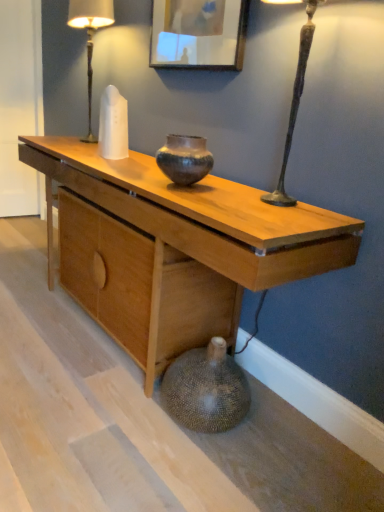
This screenshot has width=384, height=512. Identify the location of earthy brown ceramic vase at center. (184, 159).

What do you see at coordinates (200, 221) in the screenshot? I see `natural wood desk at center` at bounding box center [200, 221].

Image resolution: width=384 pixels, height=512 pixels. Describe the element at coordinates (90, 37) in the screenshot. I see `white glass table lamp at upper left` at that location.

Identify the location of earthy brown ceramic vase at center. (184, 159).

From the image's perspective, is wooden picture frame at upper center above or below natural wood desk at center?

wooden picture frame at upper center is situated higher than natural wood desk at center in the image.

Can you confirm if wooden picture frame at upper center is bigger than natural wood desk at center?

Incorrect, wooden picture frame at upper center is not larger than natural wood desk at center.

Are wooden picture frame at upper center and natural wood desk at center beside each other?

No, wooden picture frame at upper center is not making contact with natural wood desk at center.

Consider the image. Is wooden picture frame at upper center oriented away from natural wood desk at center?

wooden picture frame at upper center does not have its back to natural wood desk at center.

Considering the positions of objects earthy brown ceramic vase at center and wooden picture frame at upper center in the image provided, who is behind, earthy brown ceramic vase at center or wooden picture frame at upper center?

Positioned behind is wooden picture frame at upper center.

Is the surface of earthy brown ceramic vase at center in direct contact with wooden picture frame at upper center?

earthy brown ceramic vase at center and wooden picture frame at upper center are clearly separated.

Which is less distant, (194, 180) or (202, 33)?

The point (194, 180) is closer to the camera.

In the scene shown: From a real-world perspective, is earthy brown ceramic vase at center under wooden picture frame at upper center?

Yes.

How much distance is there between natural wood desk at center and wooden picture frame at upper center?

natural wood desk at center is 29.23 inches from wooden picture frame at upper center.

Considering the sizes of objects natural wood desk at center and wooden picture frame at upper center in the image provided, who is thinner, natural wood desk at center or wooden picture frame at upper center?

wooden picture frame at upper center is thinner.

Between point (304, 227) and point (229, 21), which one is positioned behind?

Positioned behind is point (229, 21).

Is natural wood desk at center oriented away from wooden picture frame at upper center?

No, natural wood desk at center is not facing away from wooden picture frame at upper center.

Considering the positions of point (231, 219) and point (91, 56), is point (231, 219) closer or farther from the camera than point (91, 56)?

Point (231, 219) is positioned closer to the camera compared to point (91, 56).

Which of these two, natural wood desk at center or white glass table lamp at upper left, stands taller?

Standing taller between the two is natural wood desk at center.

Based on the photo, which is correct: natural wood desk at center is inside white glass table lamp at upper left, or outside of it?

natural wood desk at center is located beyond the bounds of white glass table lamp at upper left.

Does point (76, 0) lie behind point (188, 147)?

Yes.

What's the angular difference between white glass table lamp at upper left and earthy brown ceramic vase at center's facing directions?

The angle between the facing direction of white glass table lamp at upper left and the facing direction of earthy brown ceramic vase at center is 0.62 degrees.

Visually, is white glass table lamp at upper left positioned to the left or to the right of earthy brown ceramic vase at center?

From the image, it's evident that white glass table lamp at upper left is to the left of earthy brown ceramic vase at center.

From the picture: Could you tell me if white glass table lamp at upper left is facing earthy brown ceramic vase at center?

No, white glass table lamp at upper left is not oriented towards earthy brown ceramic vase at center.

Between natural wood desk at center and earthy brown ceramic vase at center, which one has smaller width?

Thinner between the two is earthy brown ceramic vase at center.

Which is nearer, (x=107, y=200) or (x=178, y=157)?

Point (x=107, y=200) appears to be farther away from the viewer than point (x=178, y=157).

Looking at this image, from the image's perspective, is natural wood desk at center on earthy brown ceramic vase at center?

Actually, natural wood desk at center appears below earthy brown ceramic vase at center in the image.

Is natural wood desk at center facing towards earthy brown ceramic vase at center?

No, natural wood desk at center is not aimed at earthy brown ceramic vase at center.

Is wooden picture frame at upper center facing away from white glass table lamp at upper left?

That's not correct — wooden picture frame at upper center is not looking away from white glass table lamp at upper left.

Is wooden picture frame at upper center positioned in front of white glass table lamp at upper left?

Yes, wooden picture frame at upper center is closer to the camera.

The width and height of the screenshot is (384, 512). I want to click on picture frame on the right side of white glass table lamp at upper left, so click(x=199, y=33).

From the image's perspective, which one is positioned lower, wooden picture frame at upper center or white glass table lamp at upper left?

wooden picture frame at upper center appears lower in the image.

At what (x,y) coordinates should I click in order to perform the action: click on desk that is below the wooden picture frame at upper center (from the image's perspective). Please return your answer as a coordinate pair (x, y). This screenshot has height=512, width=384. Looking at the image, I should click on 200,221.

You are a GUI agent. You are given a task and a screenshot of the screen. Output one action in this format:
    pyautogui.click(x=<x>, y=<y>)
    Task: Click on the vase that appears in front of the wooden picture frame at upper center
    The height and width of the screenshot is (512, 384).
    Given the screenshot: What is the action you would take?
    pyautogui.click(x=184, y=159)

From the image, which object appears to be farther from wooden picture frame at upper center, white glass table lamp at upper left or earthy brown ceramic vase at center?

white glass table lamp at upper left is positioned further to the anchor wooden picture frame at upper center.

Considering their positions, is earthy brown ceramic vase at center positioned further to wooden picture frame at upper center than white glass table lamp at upper left?

Based on the image, white glass table lamp at upper left appears to be further to wooden picture frame at upper center.

Based on their spatial positions, is wooden picture frame at upper center or earthy brown ceramic vase at center closer to white glass table lamp at upper left?

The object closer to white glass table lamp at upper left is wooden picture frame at upper center.

When comparing their distances from natural wood desk at center, does white glass table lamp at upper left or wooden picture frame at upper center seem closer?

Among the two, wooden picture frame at upper center is located nearer to natural wood desk at center.

Based on their spatial positions, is earthy brown ceramic vase at center or wooden picture frame at upper center closer to white glass table lamp at upper left?

wooden picture frame at upper center is positioned closer to the anchor white glass table lamp at upper left.

Looking at the image, which one is located further to earthy brown ceramic vase at center, natural wood desk at center or white glass table lamp at upper left?

Among the two, white glass table lamp at upper left is located further to earthy brown ceramic vase at center.

From the image, which object appears to be farther from wooden picture frame at upper center, natural wood desk at center or white glass table lamp at upper left?

white glass table lamp at upper left is positioned further to the anchor wooden picture frame at upper center.

Considering their positions, is white glass table lamp at upper left positioned closer to wooden picture frame at upper center than natural wood desk at center?

natural wood desk at center is positioned closer to the anchor wooden picture frame at upper center.

Where is `vase between wooden picture frame at upper center and natural wood desk at center in the up-down direction`? vase between wooden picture frame at upper center and natural wood desk at center in the up-down direction is located at coordinates (184, 159).

Locate an element on the screen. This screenshot has width=384, height=512. picture frame between white glass table lamp at upper left and earthy brown ceramic vase at center in the up-down direction is located at coordinates (199, 33).

I want to click on picture frame that lies between white glass table lamp at upper left and natural wood desk at center from top to bottom, so click(x=199, y=33).

Locate an element on the screen. vase between white glass table lamp at upper left and natural wood desk at center from top to bottom is located at coordinates (184, 159).